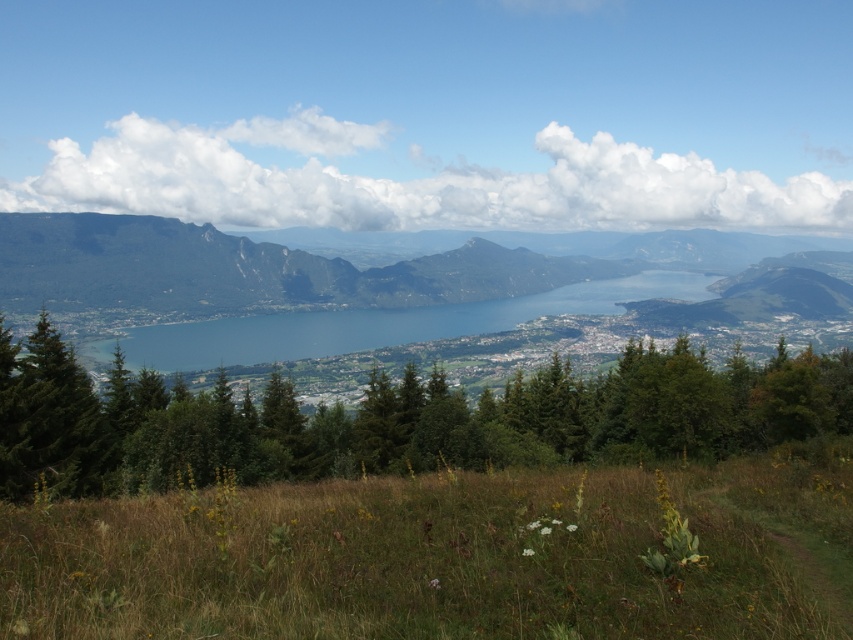
Question: Estimate the real-world distances between objects in this image. Which object is farther from the green forested mountain at center?

Choices:
 (A) green grassy field at lower center
 (B) green leafy trees at center
 (C) blue water at center

Answer: (A)

Question: Observing the image, what is the correct spatial positioning of green leafy trees at center in reference to green forested mountain at center?

Choices:
 (A) right
 (B) left

Answer: (B)

Question: Which point appears closest to the camera in this image?

Choices:
 (A) (486, 493)
 (B) (392, 336)
 (C) (67, 481)
 (D) (73, 352)

Answer: (A)

Question: Does green grassy field at lower center have a larger size compared to green leafy trees at center?

Choices:
 (A) no
 (B) yes

Answer: (A)

Question: Among these points, which one is nearest to the camera?

Choices:
 (A) (9, 611)
 (B) (64, 483)
 (C) (633, 236)
 (D) (427, 339)

Answer: (A)

Question: Can you confirm if green grassy field at lower center is smaller than green forested mountain at center?

Choices:
 (A) yes
 (B) no

Answer: (A)